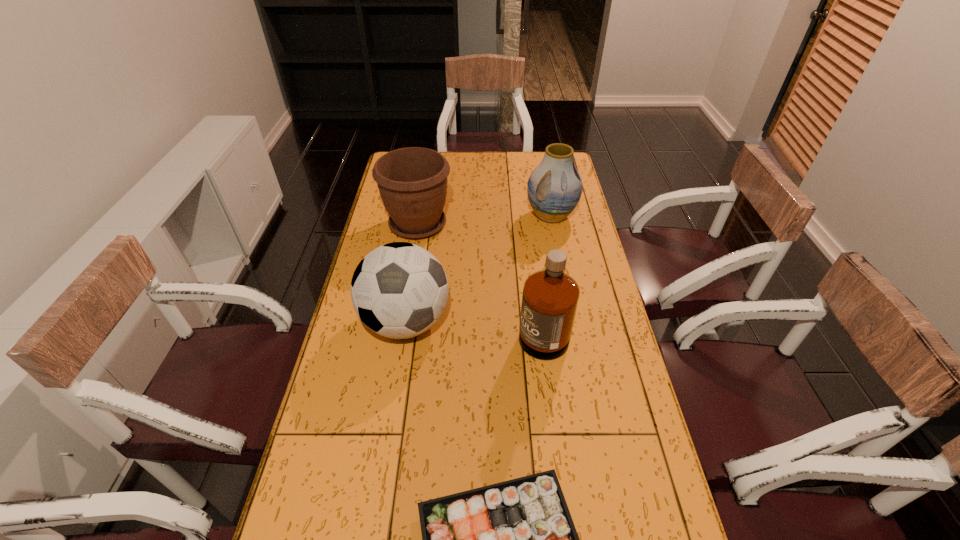
Locate an element on the screen. The height and width of the screenshot is (540, 960). soccer ball that is at the left edge is located at coordinates (399, 290).

Find the location of a particular element. flowerpot located in the left edge section of the desktop is located at coordinates (412, 181).

This screenshot has width=960, height=540. I want to click on liquor located at the right edge, so click(550, 297).

At what (x,y) coordinates should I click in order to perform the action: click on vase located at the right edge. Please return your answer as a coordinate pair (x, y). This screenshot has height=540, width=960. Looking at the image, I should click on (554, 188).

Where is `vacant area at the far edge`? This screenshot has height=540, width=960. vacant area at the far edge is located at coordinates (529, 160).

Where is `vacant space at the left edge of the desktop`? vacant space at the left edge of the desktop is located at coordinates (350, 375).

The height and width of the screenshot is (540, 960). In order to click on blank space at the right edge in this screenshot , I will do click(611, 388).

I want to click on vacant point located between the vase and the flowerpot, so click(485, 220).

Image resolution: width=960 pixels, height=540 pixels. What are the coordinates of `vacant space in between the vase and the soccer ball` in the screenshot? It's located at (478, 269).

At what (x,y) coordinates should I click in order to perform the action: click on vacant area that lies between the soccer ball and the vase. Please return your answer as a coordinate pair (x, y). Looking at the image, I should click on (478, 269).